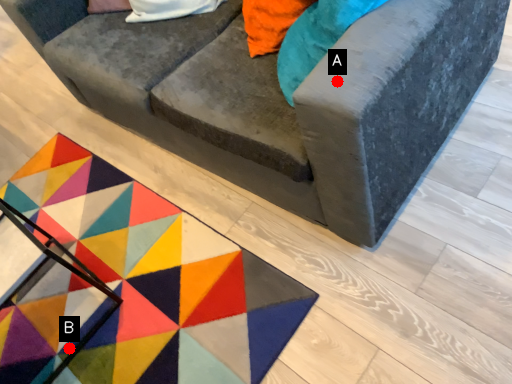
Question: Two points are circled on the image, labeled by A and B beside each circle. Which of the following is the farthest from the observer?

Choices:
 (A) A is further
 (B) B is further

Answer: (B)